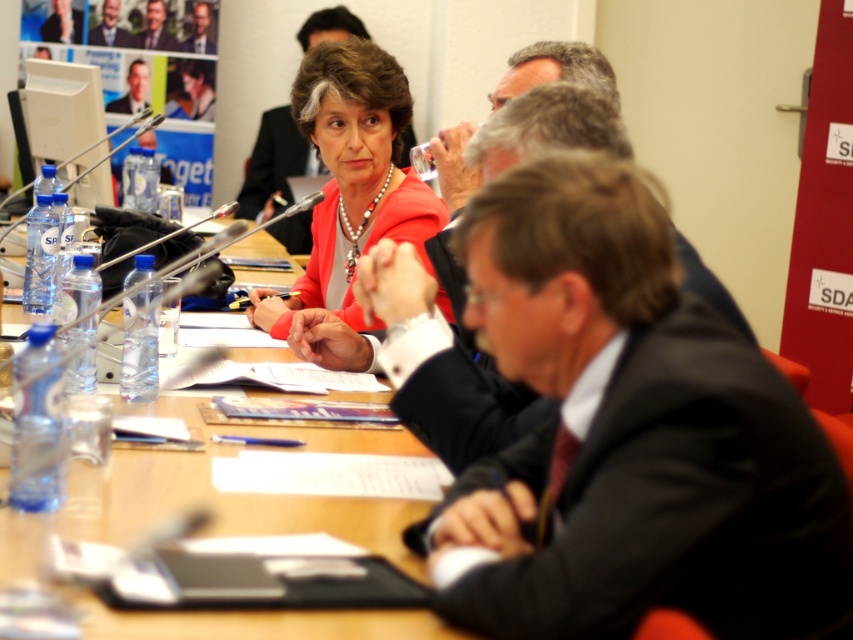
Question: Which object is closer to the camera taking this photo?

Choices:
 (A) matte black suit at center
 (B) matte red dress at center

Answer: (A)

Question: Which object is the farthest from the gray hair at upper center?

Choices:
 (A) dark suit at center
 (B) matte red dress at center

Answer: (A)

Question: Does wooden table at center appear on the right side of matte black suit at center?

Choices:
 (A) no
 (B) yes

Answer: (A)

Question: Can you confirm if dark suit at center is positioned above gray hair at upper center?

Choices:
 (A) yes
 (B) no

Answer: (B)

Question: Is wooden table at center below matte black suit at center?

Choices:
 (A) no
 (B) yes

Answer: (B)

Question: Which object is the farthest from the gray hair at upper center?

Choices:
 (A) dark suit at center
 (B) matte black suit at center

Answer: (A)